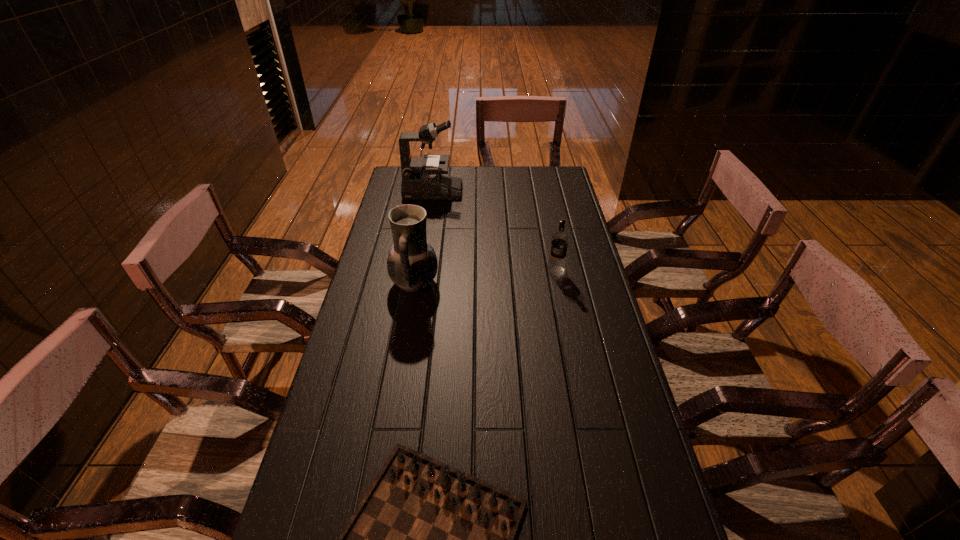
Locate an element on the screen. This screenshot has height=540, width=960. the farthest object is located at coordinates (421, 177).

At what (x,y) coordinates should I click in order to perform the action: click on pitcher. Please return your answer as a coordinate pair (x, y). Image resolution: width=960 pixels, height=540 pixels. Looking at the image, I should click on (412, 264).

Locate an element on the screen. the third tallest object is located at coordinates (559, 240).

Where is `vodka`? Image resolution: width=960 pixels, height=540 pixels. vodka is located at coordinates click(x=559, y=240).

I want to click on vacant space located 0.280m through the eyepieces of the microscope, so click(x=525, y=191).

Locate an element on the screen. vacant space positioned on the front-facing side of the pitcher is located at coordinates (487, 283).

The width and height of the screenshot is (960, 540). I want to click on vacant space located 0.170m on the label of the vodka, so click(564, 312).

Find the location of a particular element. object positioned at the far edge is located at coordinates (421, 177).

Where is `microscope positioned at the left edge`? The height and width of the screenshot is (540, 960). microscope positioned at the left edge is located at coordinates (421, 177).

Identify the location of pitcher positioned at the left edge. The width and height of the screenshot is (960, 540). (412, 264).